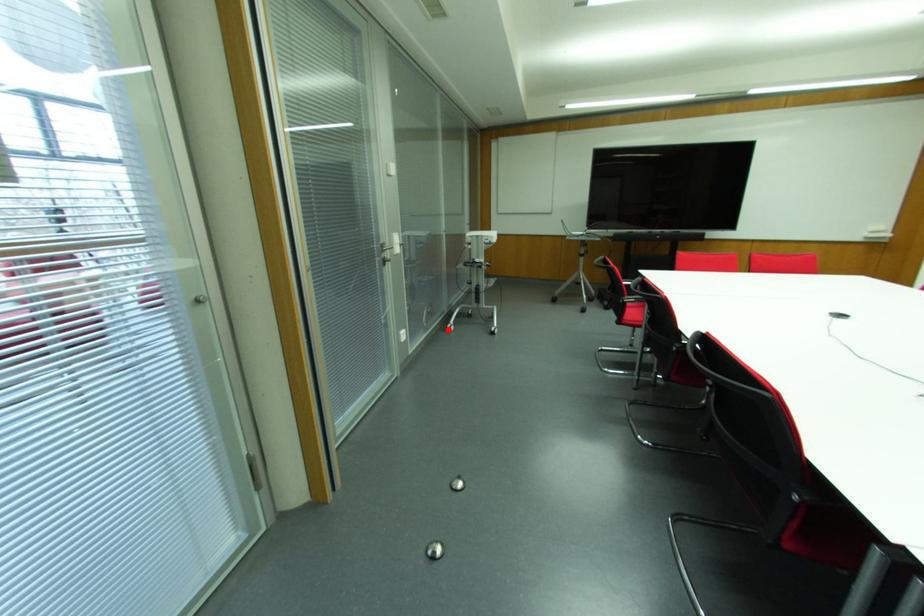
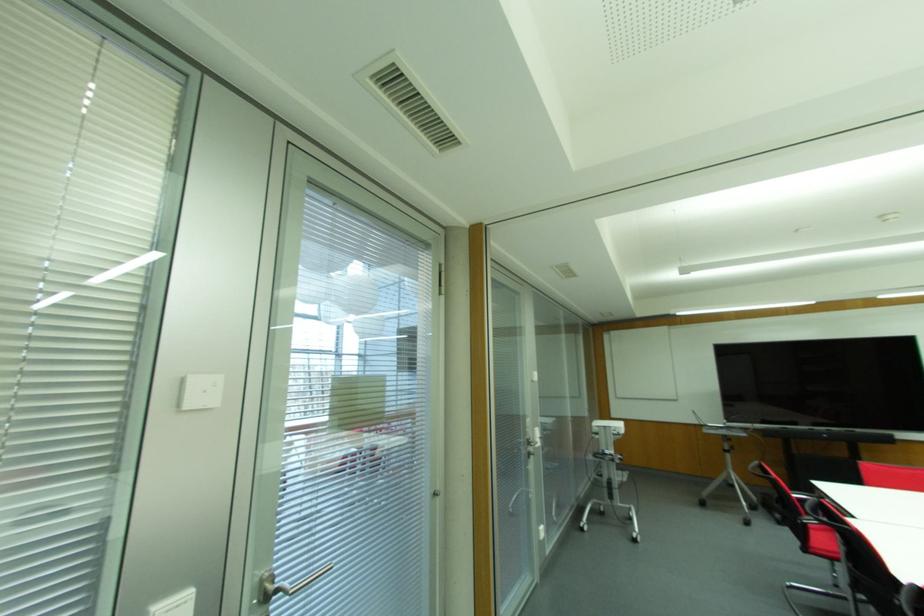
Where in the second image is the point corresponding to the highlighted location from the first image?

(581, 529)